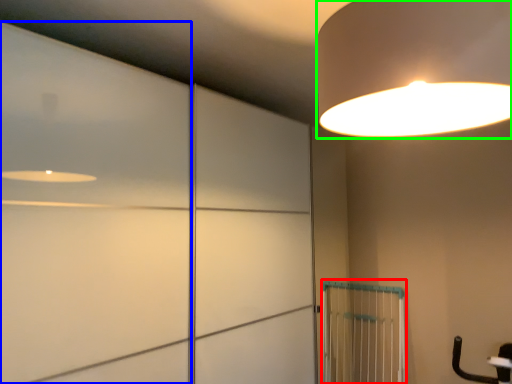
Question: Which is farther away from cage (highlighted by a red box)? door (highlighted by a blue box) or lamp (highlighted by a green box)?

Choices:
 (A) door
 (B) lamp

Answer: (B)